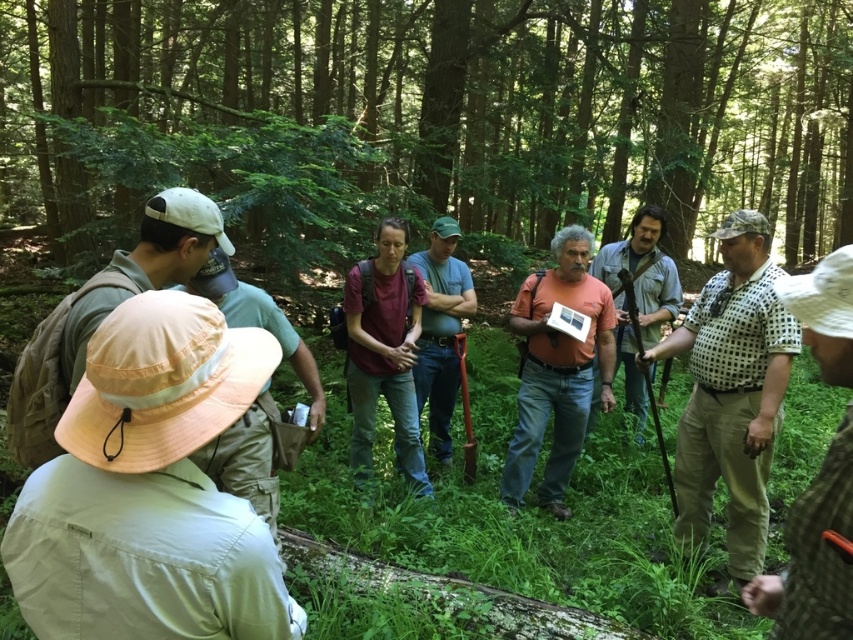
Question: Can you confirm if orange matte shirt at center is smaller than matte brown shirt at center?

Choices:
 (A) yes
 (B) no

Answer: (A)

Question: Which point is farther to the camera?

Choices:
 (A) (743, 152)
 (B) (422, 317)

Answer: (A)

Question: Which of the following is the farthest from the observer?

Choices:
 (A) (831, 177)
 (B) (549, 326)
 (C) (393, 225)

Answer: (A)

Question: Considering the relative positions of green leafy tree at center and maroon fabric shirt at center in the image provided, where is green leafy tree at center located with respect to maroon fabric shirt at center?

Choices:
 (A) above
 (B) below

Answer: (A)

Question: Can you confirm if orange matte shirt at center is positioned above matte brown shirt at center?

Choices:
 (A) no
 (B) yes

Answer: (A)

Question: Which point is farther to the camera?

Choices:
 (A) green leafy tree at center
 (B) maroon fabric shirt at center

Answer: (B)